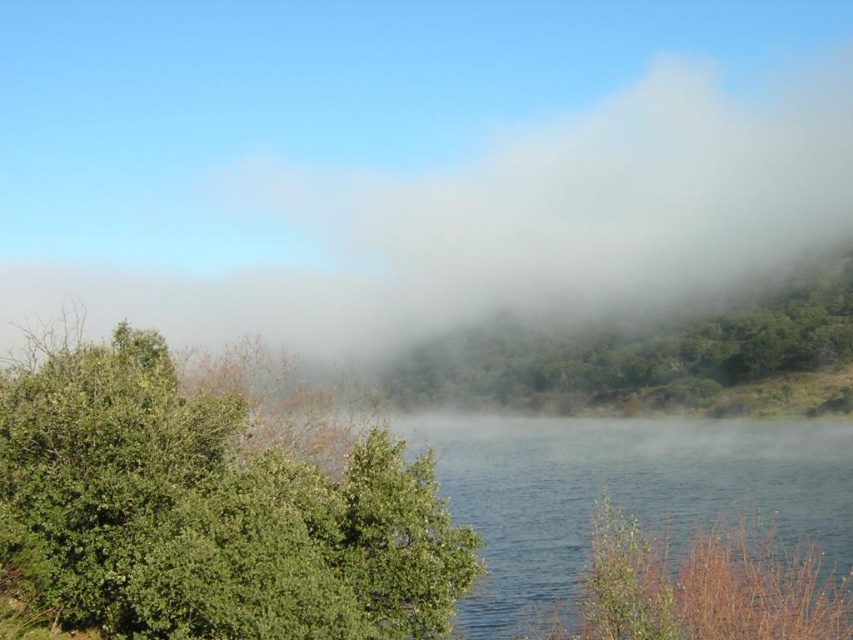
Question: Is green leafy bush at center behind clear water at center?

Choices:
 (A) yes
 (B) no

Answer: (B)

Question: Does white misty fog at upper center appear under green leafy bush at center?

Choices:
 (A) no
 (B) yes

Answer: (A)

Question: Is green leafy bush at center wider than green leafy trees at center?

Choices:
 (A) yes
 (B) no

Answer: (B)

Question: Which point appears farthest from the camera in this image?

Choices:
 (A) (268, 177)
 (B) (630, 429)

Answer: (A)

Question: Which object appears farthest from the camera in this image?

Choices:
 (A) white misty fog at upper center
 (B) green leafy trees at center
 (C) clear water at center

Answer: (B)

Question: Based on their relative distances, which object is nearer to the clear water at center?

Choices:
 (A) green leafy trees at center
 (B) white misty fog at upper center

Answer: (A)